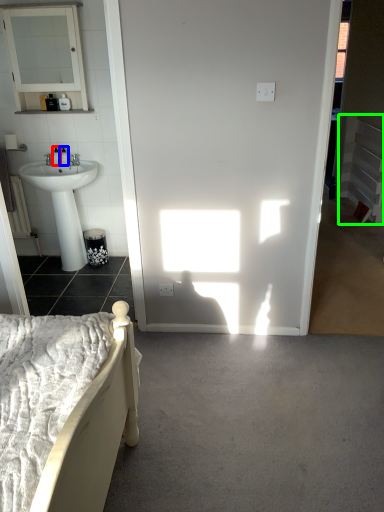
Question: Estimate the real-world distances between objects in this image. Which object is farther from toiletry (highlighted by a red box), toiletry (highlighted by a blue box) or balustrade (highlighted by a green box)?

Choices:
 (A) toiletry
 (B) balustrade

Answer: (B)